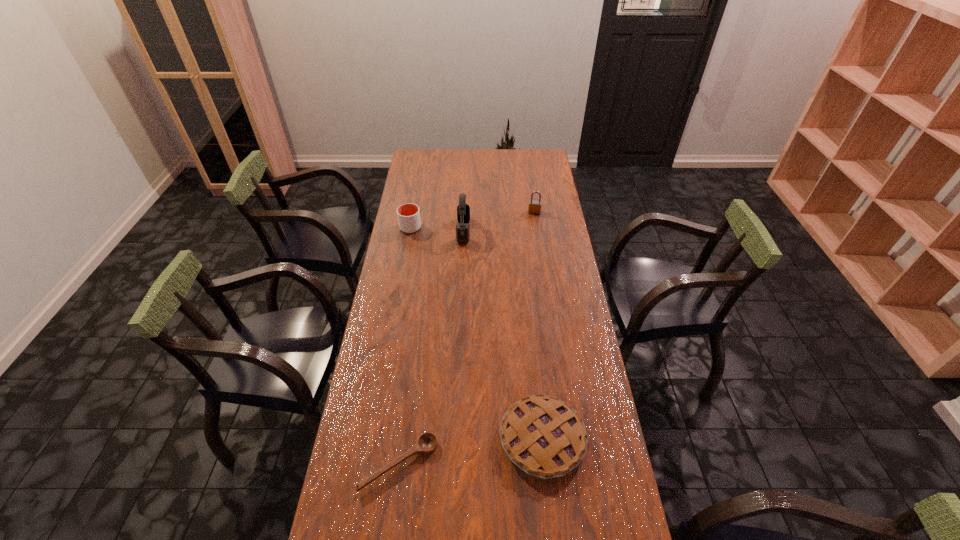
Locate an element on the screen. The height and width of the screenshot is (540, 960). the tallest object is located at coordinates (463, 210).

Where is `headset`? headset is located at coordinates (463, 210).

I want to click on padlock, so [x=534, y=207].

The width and height of the screenshot is (960, 540). I want to click on the farthest object, so click(x=534, y=207).

The height and width of the screenshot is (540, 960). Identify the location of cup. (408, 214).

Where is `the fourth tallest object`? The image size is (960, 540). the fourth tallest object is located at coordinates (542, 435).

Locate an element on the screen. The image size is (960, 540). wooden spoon is located at coordinates (426, 444).

You are a GUI agent. You are given a task and a screenshot of the screen. Output one action in this format:
    pyautogui.click(x=<x>, y=<y>)
    Task: Click on the vacant space located 0.280m on the headband of the tallest object
    This screenshot has height=540, width=960.
    Given the screenshot: What is the action you would take?
    pyautogui.click(x=533, y=231)

Where is `free space located on the front of the fourth shortest object`? free space located on the front of the fourth shortest object is located at coordinates pos(538,234).

This screenshot has height=540, width=960. I want to click on free location located on the back of the third tallest object, so click(x=414, y=210).